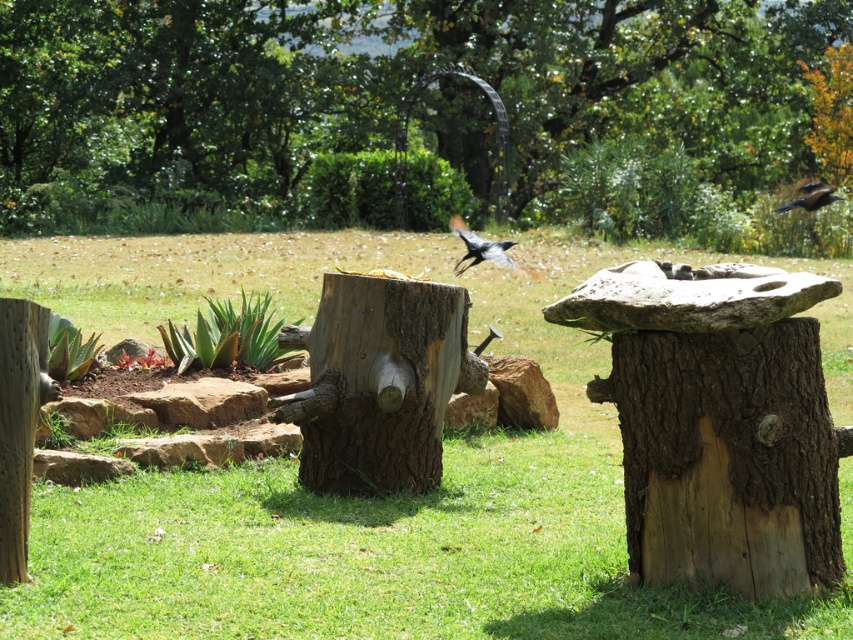
Question: Does green grass at center appear on the left side of shiny black bird at upper right?

Choices:
 (A) no
 (B) yes

Answer: (B)

Question: Can you confirm if green grass at center is wider than brown rough tree trunk at center-right?

Choices:
 (A) yes
 (B) no

Answer: (A)

Question: Among these points, which one is nearest to the camera?

Choices:
 (A) (631, 340)
 (B) (135, 161)
 (C) (428, 486)

Answer: (A)

Question: Which object is positioned closest to the green grass at center?

Choices:
 (A) shiny black bird at center
 (B) brown rough tree stump at center

Answer: (B)

Question: Based on their relative distances, which object is nearer to the brown rough tree stump at center?

Choices:
 (A) rough bark stump at center
 (B) brown rough tree trunk at center-right
 (C) shiny black bird at center

Answer: (B)

Question: Does brown rough tree trunk at center-right appear on the right side of shiny black bird at upper right?

Choices:
 (A) yes
 (B) no

Answer: (B)